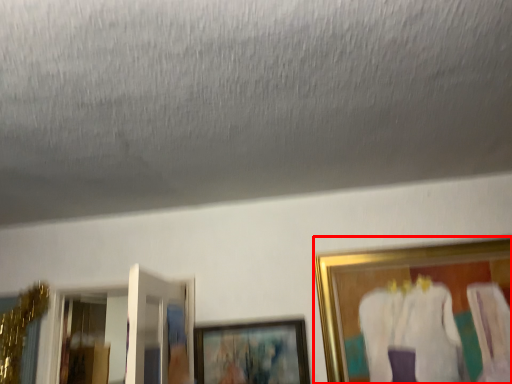
Question: From the image's perspective, what is the correct spatial positioning of picture frame (annotated by the red box) in reference to picture frame?

Choices:
 (A) above
 (B) below

Answer: (A)